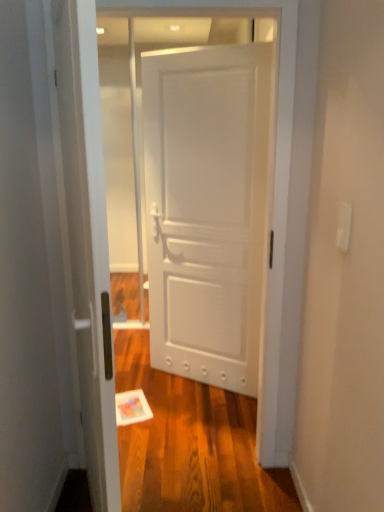
What is the approximate width of white matte door at center?

white matte door at center is 3.87 inches wide.

I want to click on white matte door at center, so click(206, 208).

The height and width of the screenshot is (512, 384). What do you see at coordinates (206, 208) in the screenshot?
I see `white matte door at center` at bounding box center [206, 208].

This screenshot has width=384, height=512. Find the location of `white matte door at center`. white matte door at center is located at coordinates (206, 208).